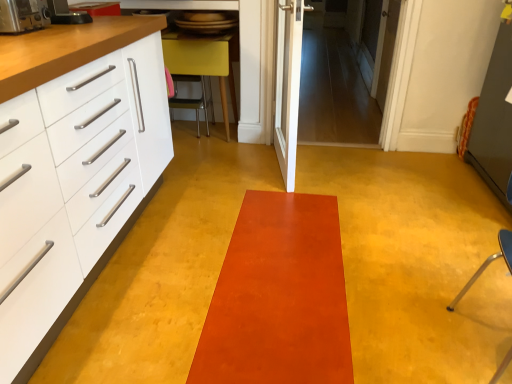
Based on the photo, measure the distance between point (294, 289) and camera.

The depth of point (294, 289) is 1.71 meters.

What do you see at coordinates (202, 63) in the screenshot? The height and width of the screenshot is (384, 512). I see `matte yellow chair at center, the first furniture viewed from the back` at bounding box center [202, 63].

What is the approximate width of metallic silver chair at center?

It is 15.91 inches.

Measure the distance between point (9, 1) and camera.

The distance of point (9, 1) from camera is 5.28 feet.

Find the location of a particular element. The width and height of the screenshot is (512, 384). white glossy cabinet at left is located at coordinates (42, 182).

Identify the location of blue plastic chair at right, which is counted as the second furniture, starting from the left. The height and width of the screenshot is (384, 512). (489, 263).

This screenshot has width=512, height=384. I want to click on metallic silver toaster at left, the first appliance from the back, so click(x=66, y=13).

Which of these two, satin orange mat at center or metallic silver toaster at left, the 2th appliance from the back, is wider?

Wider between the two is satin orange mat at center.

Is point (250, 275) farther from camera compared to point (48, 24)?

No, it is not.

Does satin orange mat at center turn towards metallic silver toaster at left, the 2th appliance from the back?

No.

Between satin orange mat at center and metallic silver toaster at left, positioned as the 1th appliance in front-to-back order, which one appears on the left side from the viewer's perspective?

Positioned to the left is metallic silver toaster at left, positioned as the 1th appliance in front-to-back order.

Based on the photo, from a real-world perspective, is metallic silver chair at center positioned above or below blue plastic chair at right, which ranks as the 1th furniture in bottom-to-top order?

From a real-world perspective, metallic silver chair at center is physically below blue plastic chair at right, which ranks as the 1th furniture in bottom-to-top order.

Considering the positions of objects metallic silver chair at center and blue plastic chair at right, which ranks as the 1th furniture in bottom-to-top order, in the image provided, who is more to the right, metallic silver chair at center or blue plastic chair at right, which ranks as the 1th furniture in bottom-to-top order,?

From the viewer's perspective, blue plastic chair at right, which ranks as the 1th furniture in bottom-to-top order, appears more on the right side.

Is metallic silver chair at center facing towards blue plastic chair at right, the second furniture viewed from the back?

No, metallic silver chair at center does not turn towards blue plastic chair at right, the second furniture viewed from the back.

In the image, is metallic silver chair at center on the left side or the right side of white glossy cabinet at left?

Clearly, metallic silver chair at center is on the right of white glossy cabinet at left in the image.

Which point is more distant from viewer, (206, 120) or (2, 247)?

Positioned behind is point (206, 120).

Is metallic silver chair at center oriented towards white glossy cabinet at left?

Yes, metallic silver chair at center is aimed at white glossy cabinet at left.

Is metallic silver chair at center inside or outside of white glossy cabinet at left?

metallic silver chair at center is not inside white glossy cabinet at left, it's outside.

From a real-world perspective, between white wooden door at upper right, the second door from the front, and white glossy door at center, the first door in the front-to-back sequence, who is vertically lower?

From a 3D spatial view, white wooden door at upper right, the second door from the front, is below.

Between white wooden door at upper right, arranged as the 2th door when viewed from the left, and white glossy door at center, acting as the second door starting from the right, which one has larger size?

white glossy door at center, acting as the second door starting from the right.

Considering the points (386, 10) and (285, 9), which point is in front, point (386, 10) or point (285, 9)?

The point (285, 9) is in front.

From the image's perspective, is white wooden door at upper right, positioned as the 1th door in right-to-left order, located above or below white glossy door at center, placed as the second door when sorted from back to front?

white wooden door at upper right, positioned as the 1th door in right-to-left order, is situated higher than white glossy door at center, placed as the second door when sorted from back to front, in the image.

Can you tell me how much white glossy door at center, acting as the second door starting from the right, and metallic silver chair at center differ in facing direction?

99.9 degrees.

Is white glossy door at center, acting as the second door starting from the right, turned away from metallic silver chair at center?

No, white glossy door at center, acting as the second door starting from the right, is not facing away from metallic silver chair at center.

Relative to metallic silver chair at center, is white glossy door at center, acting as the second door starting from the right, in front or behind?

white glossy door at center, acting as the second door starting from the right, is positioned closer to the viewer than metallic silver chair at center.

From a real-world perspective, who is located higher, white glossy door at center, acting as the second door starting from the right, or metallic silver chair at center?

white glossy door at center, acting as the second door starting from the right, from a real-world perspective.

Considering the positions of objects metallic silver toaster at left, placed as the second appliance when sorted from front to back, and metallic silver chair at center in the image provided, who is more to the left, metallic silver toaster at left, placed as the second appliance when sorted from front to back, or metallic silver chair at center?

metallic silver toaster at left, placed as the second appliance when sorted from front to back.

Can you confirm if metallic silver toaster at left, placed as the second appliance when sorted from front to back, is wider than metallic silver chair at center?

No.

Which is behind, metallic silver toaster at left, placed as the second appliance when sorted from front to back, or metallic silver chair at center?

metallic silver chair at center is further from the camera.

Measure the distance between metallic silver toaster at left, the first appliance from the back, and metallic silver chair at center.

metallic silver toaster at left, the first appliance from the back, is 3.76 feet away from metallic silver chair at center.

Which is more to the left, white glossy door at center, placed as the second door when sorted from back to front, or white wooden door at upper right, positioned as the 1th door in right-to-left order?

From the viewer's perspective, white glossy door at center, placed as the second door when sorted from back to front, appears more on the left side.

Based on the photo, between white glossy door at center, the first door in the front-to-back sequence, and white wooden door at upper right, positioned as the 1th door in right-to-left order, which one has less height?

With less height is white wooden door at upper right, positioned as the 1th door in right-to-left order.

Considering the points (275, 96) and (386, 82), which point is behind, point (275, 96) or point (386, 82)?

The point (386, 82) is more distant.

Between white glossy door at center, placed as the second door when sorted from back to front, and white wooden door at upper right, which appears as the first door when viewed from the back, which one has smaller size?

With smaller size is white wooden door at upper right, which appears as the first door when viewed from the back.

Image resolution: width=512 pixels, height=384 pixels. Identify the location of mat in front of the metallic silver toaster at left, positioned as the 1th appliance in front-to-back order. (279, 297).

The height and width of the screenshot is (384, 512). In order to click on furniture that is below the metallic silver chair at center (from the image's perspective) in this screenshot , I will do `click(489, 263)`.

Looking at this image, from the image, which object appears to be nearer to metallic silver chair at center, metallic silver toaster at left, placed as the second appliance when sorted from front to back, or white glossy door at center, the first door in the left-to-right sequence?

Among the two, white glossy door at center, the first door in the left-to-right sequence, is located nearer to metallic silver chair at center.

From the image, which object appears to be farther from white glossy door at center, the first door in the front-to-back sequence, white glossy cabinet at left or metallic silver toaster at left, placed as the second appliance when sorted from front to back?

Among the two, white glossy cabinet at left is located further to white glossy door at center, the first door in the front-to-back sequence.

Considering their positions, is metallic silver toaster at left, placed as the second appliance when sorted from front to back, positioned further to satin orange mat at center than matte yellow chair at center, the 2th furniture viewed from the front?

Among the two, matte yellow chair at center, the 2th furniture viewed from the front, is located further to satin orange mat at center.

From the image, which object appears to be farther from white glossy cabinet at left, metallic silver chair at center or matte yellow chair at center, the 1th furniture from the top?

Based on the image, metallic silver chair at center appears to be further to white glossy cabinet at left.

Which object lies nearer to the anchor point blue plastic chair at right, the second furniture viewed from the back, metallic silver chair at center or satin orange mat at center?

Based on the image, satin orange mat at center appears to be nearer to blue plastic chair at right, the second furniture viewed from the back.

Looking at the image, which one is located closer to matte yellow chair at center, acting as the 1th furniture starting from the left, white glossy door at center, acting as the second door starting from the right, or satin orange mat at center?

Based on the image, white glossy door at center, acting as the second door starting from the right, appears to be nearer to matte yellow chair at center, acting as the 1th furniture starting from the left.

Looking at the image, which one is located further to metallic silver toaster at left, the first appliance from the back, white glossy cabinet at left or satin orange mat at center?

Based on the image, satin orange mat at center appears to be further to metallic silver toaster at left, the first appliance from the back.

Looking at the image, which one is located closer to matte yellow chair at center, the 2th furniture viewed from the front, white glossy cabinet at left or blue plastic chair at right, arranged as the first furniture when viewed from the front?

Among the two, white glossy cabinet at left is located nearer to matte yellow chair at center, the 2th furniture viewed from the front.

The height and width of the screenshot is (384, 512). I want to click on door located between metallic silver toaster at left, placed as the second appliance when sorted from front to back, and blue plastic chair at right, the second furniture viewed from the back, in the left-right direction, so click(288, 86).

The width and height of the screenshot is (512, 384). In order to click on cabinetry between metallic silver toaster at left, the first appliance from the back, and satin orange mat at center in the up-down direction in this screenshot , I will do (42, 182).

The width and height of the screenshot is (512, 384). In order to click on appliance between white glossy cabinet at left and metallic silver toaster at left, the first appliance from the back, in the front-back direction in this screenshot , I will do `click(23, 16)`.

In order to click on furniture positioned between metallic silver toaster at left, the first appliance from the back, and metallic silver chair at center from near to far in this screenshot , I will do `click(202, 63)`.